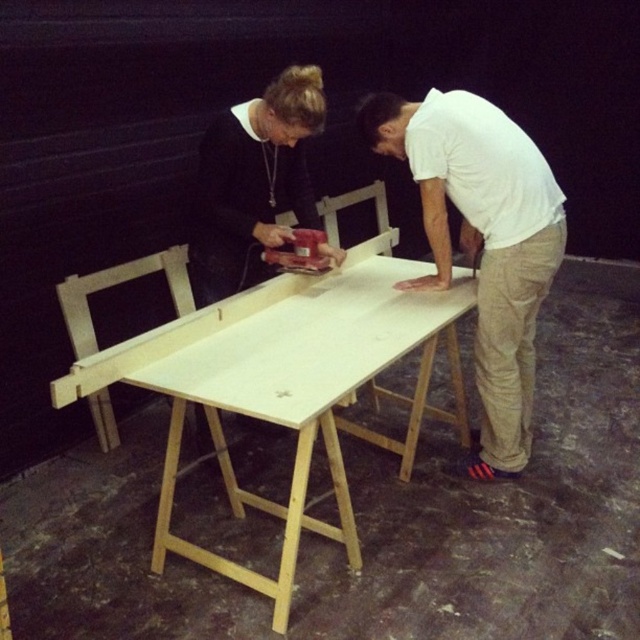
Question: Is white matte wood table at center further to the viewer compared to white matte shirt at upper center?

Choices:
 (A) no
 (B) yes

Answer: (A)

Question: Does white matte wood table at center have a smaller size compared to white cotton shirt at center?

Choices:
 (A) no
 (B) yes

Answer: (A)

Question: Based on their relative distances, which object is nearer to the white matte wood table at center?

Choices:
 (A) white cotton shirt at center
 (B) white matte shirt at upper center

Answer: (B)

Question: Does white matte wood table at center have a smaller size compared to white cotton shirt at center?

Choices:
 (A) no
 (B) yes

Answer: (A)

Question: Which of the following is the closest to the observer?

Choices:
 (A) (477, 145)
 (B) (237, 134)
 (C) (260, 416)

Answer: (C)

Question: Which point is farther to the camera?

Choices:
 (A) white cotton shirt at center
 (B) white matte wood table at center
 (C) white matte shirt at upper center

Answer: (A)